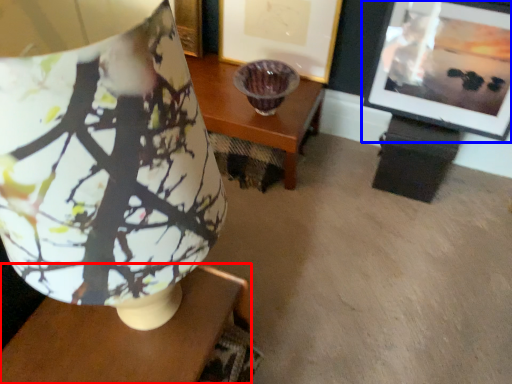
Question: Among these objects, which one is farthest to the camera, table (highlighted by a red box) or picture frame (highlighted by a blue box)?

Choices:
 (A) table
 (B) picture frame

Answer: (B)